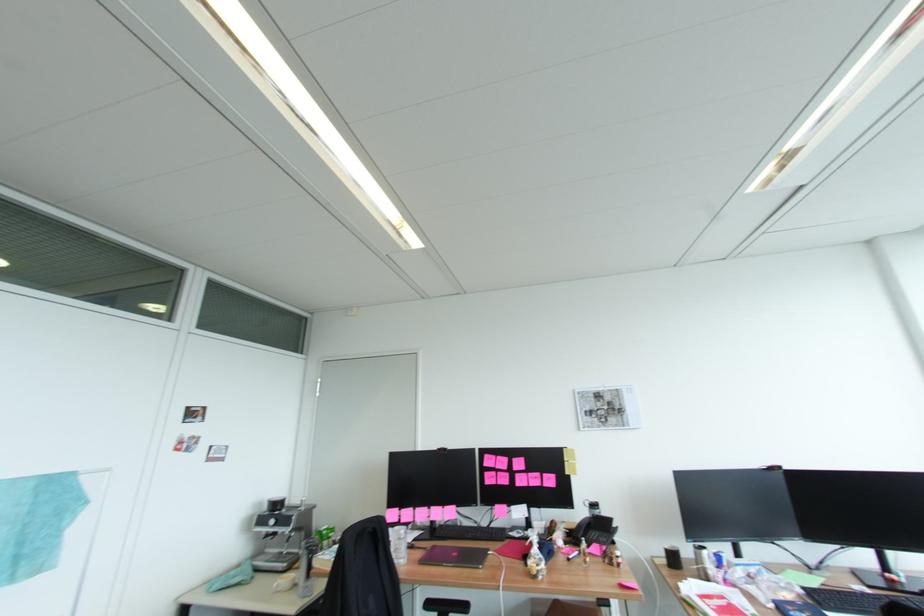
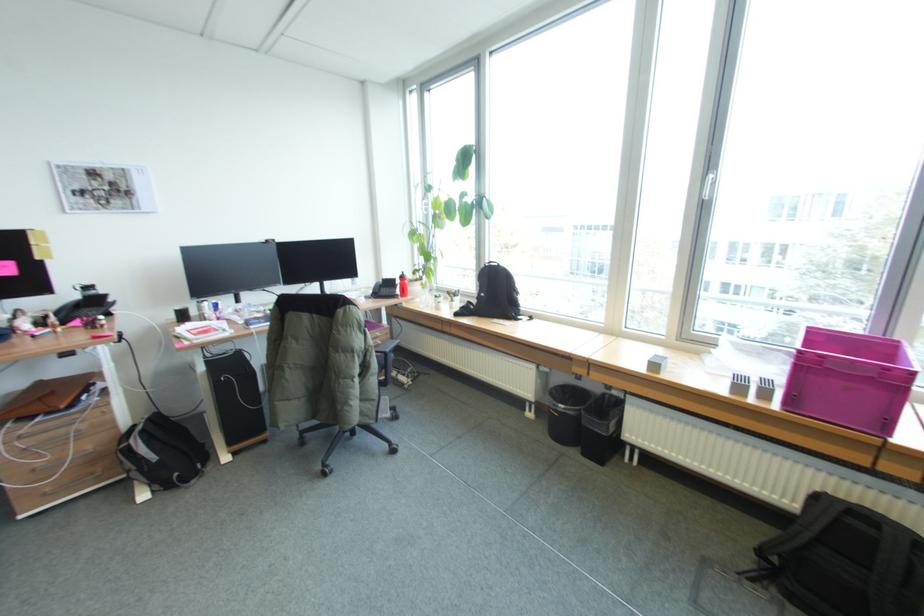
Based on the continuous images, in which direction is the camera rotating?

The camera rotated toward right-down.